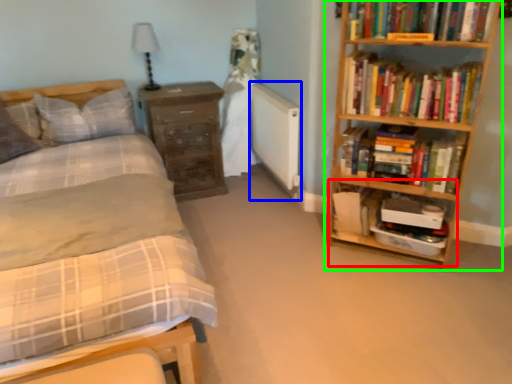
Question: Which object is positioned farthest from cabinet (highlighted by a red box)? Select from radiator (highlighted by a blue box) and bookcase (highlighted by a green box).

Choices:
 (A) radiator
 (B) bookcase

Answer: (A)